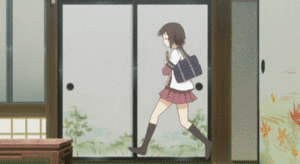
The width and height of the screenshot is (300, 164). Identify the location of first second of the gif portrays double doors. (147, 45).